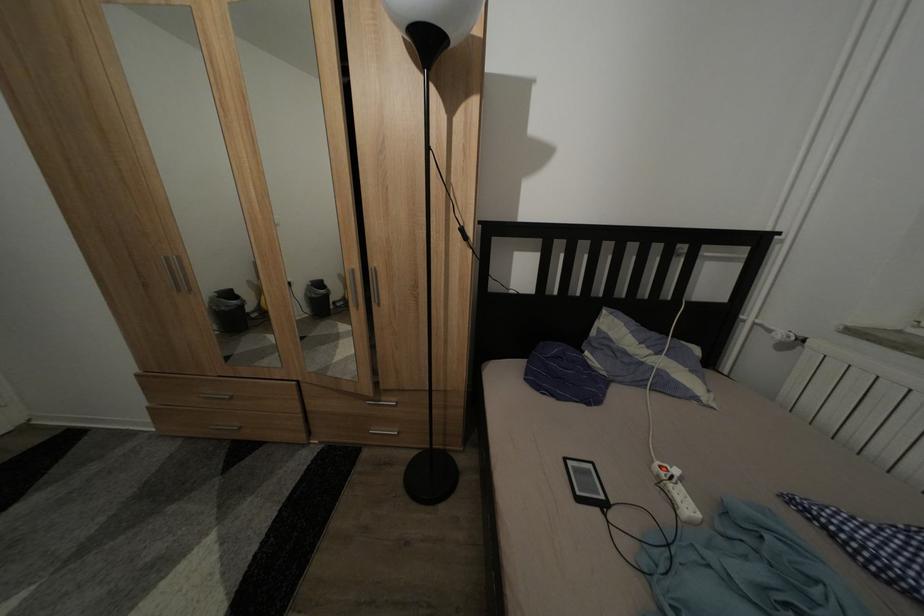
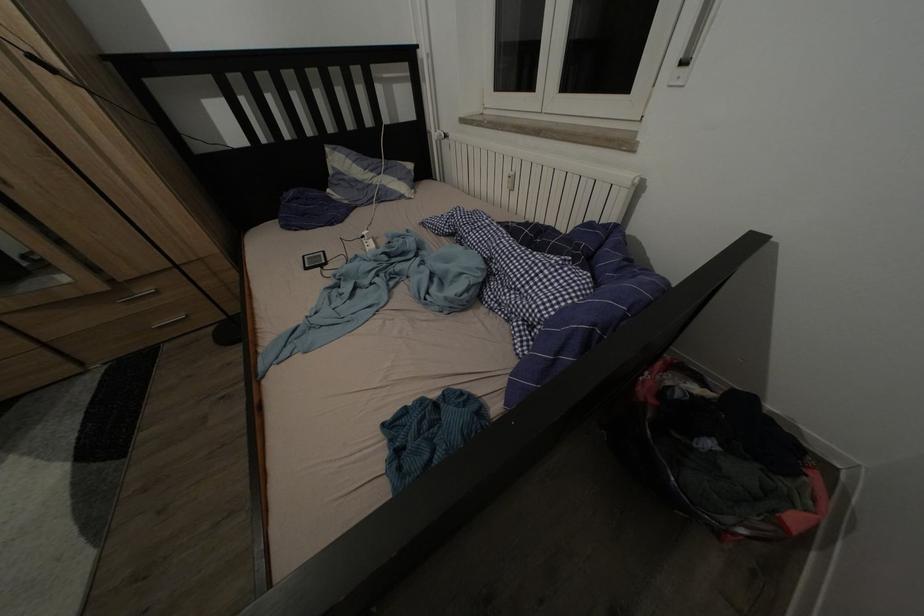
Where in the second image is the point corresponding to point 684,477 from the first image?

(372, 238)